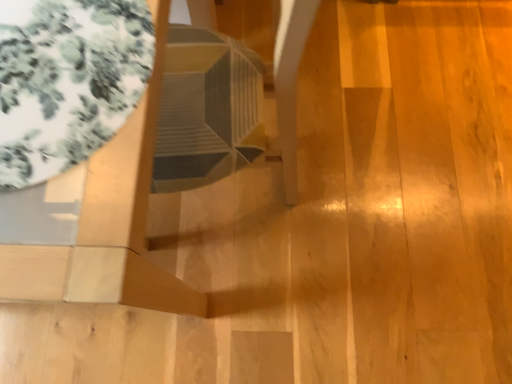
Question: Relative to matte wood side table at upper left, is transparent glass table at upper left in front or behind?

Choices:
 (A) behind
 (B) front

Answer: (A)

Question: In terms of width, does transparent glass table at upper left look wider or thinner when compared to matte wood side table at upper left?

Choices:
 (A) thin
 (B) wide

Answer: (A)

Question: Is transparent glass table at upper left inside the boundaries of matte wood side table at upper left, or outside?

Choices:
 (A) outside
 (B) inside

Answer: (B)

Question: From their relative heights in the image, would you say matte wood side table at upper left is taller or shorter than transparent glass table at upper left?

Choices:
 (A) tall
 (B) short

Answer: (A)

Question: Is matte wood side table at upper left inside or outside of transparent glass table at upper left?

Choices:
 (A) outside
 (B) inside

Answer: (A)

Question: In terms of width, does matte wood side table at upper left look wider or thinner when compared to transparent glass table at upper left?

Choices:
 (A) thin
 (B) wide

Answer: (B)

Question: Is matte wood side table at upper left bigger or smaller than transparent glass table at upper left?

Choices:
 (A) big
 (B) small

Answer: (A)